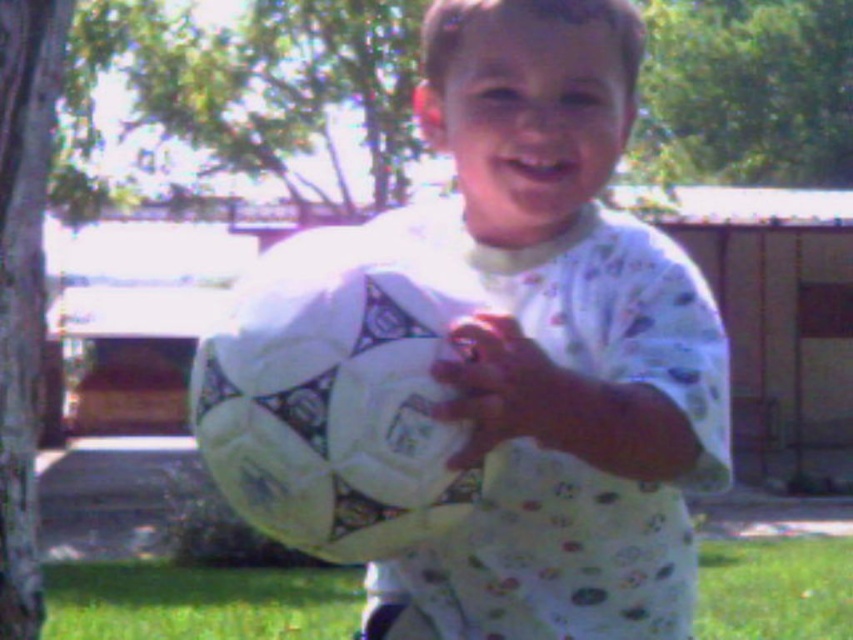
Between point (448, 284) and point (544, 396), which one is positioned in front?

Point (544, 396) is in front.

Which is more to the right, white matte soccer ball at center or smooth white glove at center?

From the viewer's perspective, smooth white glove at center appears more on the right side.

Describe the element at coordinates (485, 360) in the screenshot. I see `white matte soccer ball at center` at that location.

Locate an element on the screen. white matte soccer ball at center is located at coordinates [485, 360].

Can you confirm if green grass at lower center is wider than smooth white glove at center?

Yes, green grass at lower center is wider than smooth white glove at center.

Between point (225, 627) and point (531, 417), which one is positioned behind?

Positioned behind is point (225, 627).

Identify the location of green grass at lower center. Image resolution: width=853 pixels, height=640 pixels. (199, 602).

Is white matte soccer ball at center taller than green grass at lower center?

Correct, white matte soccer ball at center is much taller as green grass at lower center.

Can you confirm if white matte soccer ball at center is positioned above green grass at lower center?

Yes, white matte soccer ball at center is above green grass at lower center.

Describe the element at coordinates (485, 360) in the screenshot. I see `white matte soccer ball at center` at that location.

Where is `white matte soccer ball at center`? This screenshot has height=640, width=853. white matte soccer ball at center is located at coordinates (485, 360).